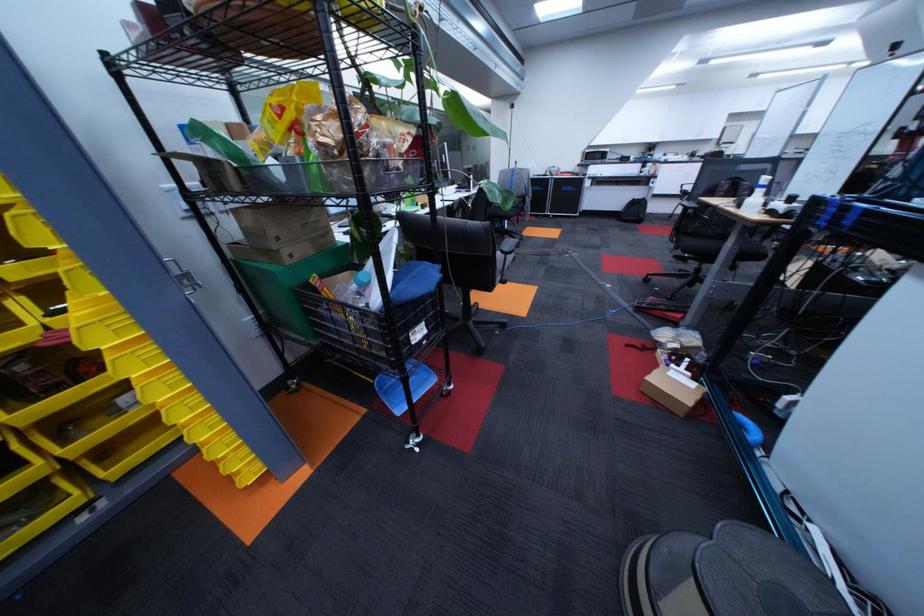
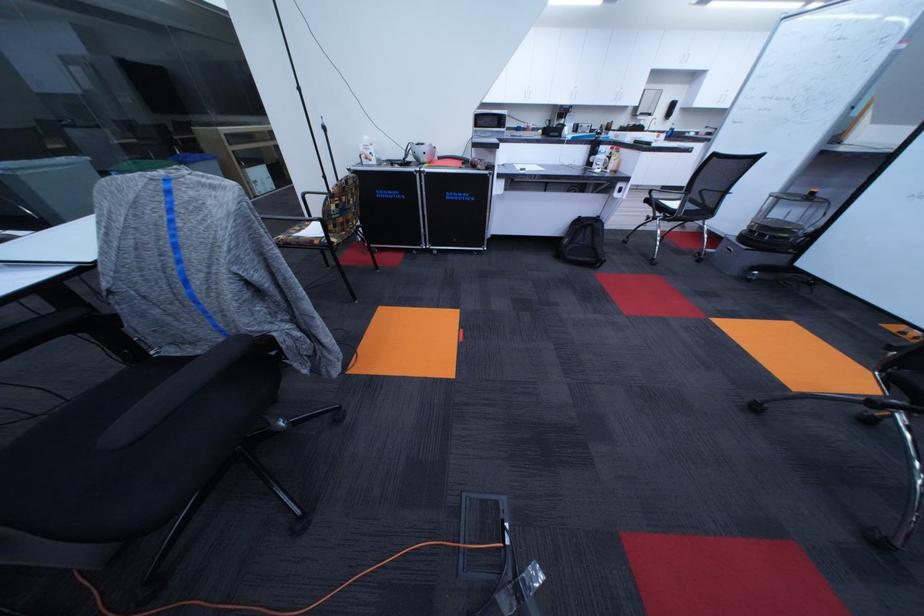
Where in the second image is the point corresponding to the point at 676,159 from the first image?

(642, 138)